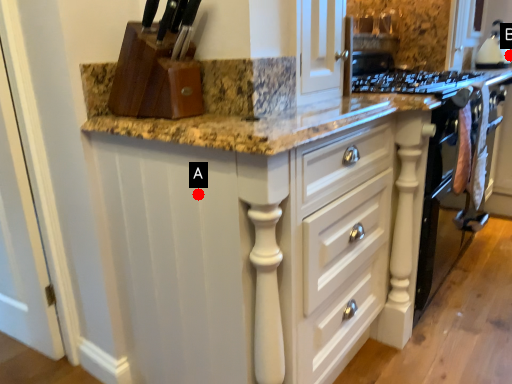
Question: Two points are circled on the image, labeled by A and B beside each circle. Which point appears farthest from the camera in this image?

Choices:
 (A) A is further
 (B) B is further

Answer: (B)